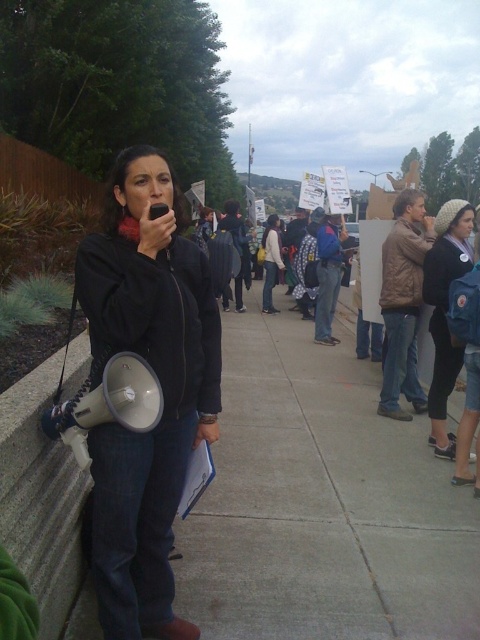
Between black matte jacket at center and knitted wool hat at center, which one has less height?

With less height is knitted wool hat at center.

Is black matte jacket at center bigger than knitted wool hat at center?

Yes, black matte jacket at center is bigger than knitted wool hat at center.

Who is more forward, (153, 588) or (440, 358)?

Point (153, 588)

Identify the location of black matte jacket at center. (160, 385).

Locate an element on the screen. black matte jacket at center is located at coordinates point(160,385).

This screenshot has height=640, width=480. Find the location of `black matte jacket at center`. black matte jacket at center is located at coordinates (160, 385).

Where is `denim jacket at center`? The height and width of the screenshot is (640, 480). denim jacket at center is located at coordinates (428, 323).

Does denim jacket at center lie in front of knitted wool hat at center?

Yes, it is in front of knitted wool hat at center.

Between point (441, 298) and point (445, 204), which one is positioned behind?

Positioned behind is point (445, 204).

Where is `denim jacket at center`? This screenshot has height=640, width=480. denim jacket at center is located at coordinates (428, 323).